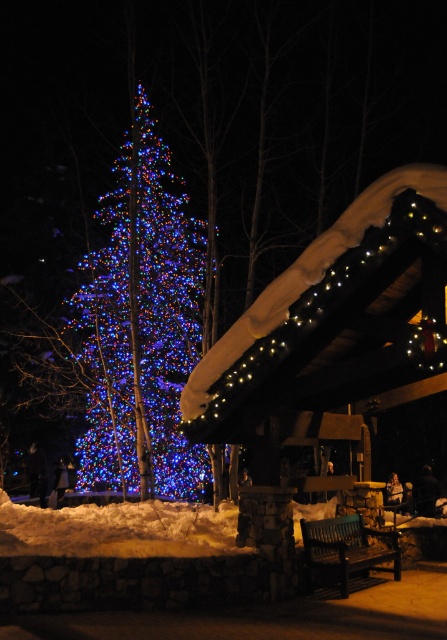
You are planning to place a new bench in your backyard. You currently have an illuminated plastic christmas tree at left and a dark wood bench at center. If you want to ensure the new bench is narrower than the existing one, what should you compare it to?

You should compare the width of the new bench to the dark wood bench at center because the illuminated plastic christmas tree at left might be wider than the dark wood bench at center, so using the existing dark wood bench at center as a reference ensures the new bench is narrower.

Consider the image. You are standing at the center of the winter scene and want to sit down. Which object, the illuminated plastic christmas tree at left or the dark wood bench at center, is closer to you?

The dark wood bench at center is closer to you because it is positioned at the center, while the illuminated plastic christmas tree at left is to the left of it.